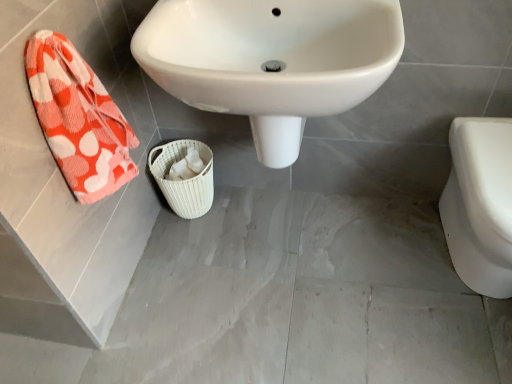
Identify the location of free region under orange-patterned towel at left (from a real-world perspective). This screenshot has height=384, width=512. (157, 266).